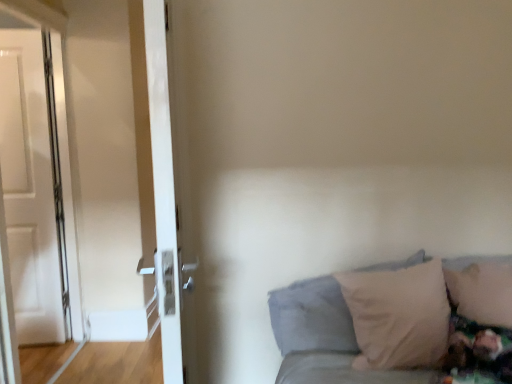
Locate an element on the screen. The image size is (512, 384). soft beige pillow at lower right, which appears as the second pillow when viewed from the right is located at coordinates (312, 317).

At what (x,y) coordinates should I click in order to perform the action: click on white glossy door at left, the 1th door viewed from the back. Please return your answer as a coordinate pair (x, y). The image size is (512, 384). Looking at the image, I should click on (32, 187).

This screenshot has width=512, height=384. I want to click on soft beige pillow at lower right, which appears as the second pillow when viewed from the right, so click(312, 317).

Is white glossy door at left, the first door viewed from the left, next to white glossy door at left, which ranks as the second door in back-to-front order?

No, white glossy door at left, the first door viewed from the left, is not beside white glossy door at left, which ranks as the second door in back-to-front order.

Could you tell me if white glossy door at left, the second door from the right, is facing white glossy door at left, the 2th door when ordered from left to right?

No.

In terms of size, does white glossy door at left, placed as the 2th door when sorted from front to back, appear bigger or smaller than white glossy door at left, the 2th door when ordered from left to right?

Considering their sizes, white glossy door at left, placed as the 2th door when sorted from front to back, takes up less space than white glossy door at left, the 2th door when ordered from left to right.

Is white glossy door at left, the 1th door viewed from the back, not within white glossy door at left, the first door positioned from the front?

That's correct, white glossy door at left, the 1th door viewed from the back, is outside of white glossy door at left, the first door positioned from the front.

From the image's perspective, is beige soft pillow at lower right, which is the first pillow from right to left, positioned above or below soft beige pillow at lower right, which appears as the second pillow when viewed from the right?

Clearly, from the image's perspective, beige soft pillow at lower right, which is the first pillow from right to left, is above soft beige pillow at lower right, which appears as the second pillow when viewed from the right.

Looking at this image, is beige soft pillow at lower right, the second pillow positioned from the left, at the right side of soft beige pillow at lower right, which appears as the second pillow when viewed from the right?

Yes, beige soft pillow at lower right, the second pillow positioned from the left, is to the right of soft beige pillow at lower right, which appears as the second pillow when viewed from the right.

Based on the photo, from a real-world perspective, who is located lower, beige soft pillow at lower right, which is the first pillow from right to left, or soft beige pillow at lower right, positioned as the first pillow in left-to-right order?

soft beige pillow at lower right, positioned as the first pillow in left-to-right order, is physically lower.

How different are the orientations of beige soft pillow at lower right, the second pillow positioned from the left, and white glossy door at left, the 1th door viewed from the back, in degrees?

The angle between the facing direction of beige soft pillow at lower right, the second pillow positioned from the left, and the facing direction of white glossy door at left, the 1th door viewed from the back, is 80.8 degrees.

Is beige soft pillow at lower right, which is the first pillow from right to left, in front of or behind white glossy door at left, the first door viewed from the left, in the image?

beige soft pillow at lower right, which is the first pillow from right to left, is positioned closer to the viewer than white glossy door at left, the first door viewed from the left.

Is white glossy door at left, the 1th door viewed from the back, located within beige soft pillow at lower right, the second pillow positioned from the left?

No, beige soft pillow at lower right, the second pillow positioned from the left, does not contain white glossy door at left, the 1th door viewed from the back.

Between beige soft pillow at lower right, the second pillow positioned from the left, and white glossy door at left, which ranks as the first door in right-to-left order, which one has more height?

Standing taller between the two is white glossy door at left, which ranks as the first door in right-to-left order.

Is beige soft pillow at lower right, which is the first pillow from right to left, completely or partially outside of white glossy door at left, which ranks as the first door in right-to-left order?

beige soft pillow at lower right, which is the first pillow from right to left, lies outside white glossy door at left, which ranks as the first door in right-to-left order,'s area.

Which object is thinner, beige soft pillow at lower right, which is the first pillow from right to left, or white glossy door at left, the 2th door when ordered from left to right?

white glossy door at left, the 2th door when ordered from left to right.

Considering the sizes of objects soft beige pillow at lower right, positioned as the first pillow in left-to-right order, and white glossy door at left, the 2th door when ordered from left to right, in the image provided, who is wider, soft beige pillow at lower right, positioned as the first pillow in left-to-right order, or white glossy door at left, the 2th door when ordered from left to right,?

Wider between the two is soft beige pillow at lower right, positioned as the first pillow in left-to-right order.

Between soft beige pillow at lower right, which appears as the second pillow when viewed from the right, and white glossy door at left, which ranks as the second door in back-to-front order, which one is positioned in front?

white glossy door at left, which ranks as the second door in back-to-front order, is closer to the camera.

How many degrees apart are the facing directions of soft beige pillow at lower right, positioned as the first pillow in left-to-right order, and white glossy door at left, the 2th door when ordered from left to right?

soft beige pillow at lower right, positioned as the first pillow in left-to-right order, and white glossy door at left, the 2th door when ordered from left to right, are facing 166 degrees away from each other.

From the picture: From a real-world perspective, which is physically above, soft beige pillow at lower right, positioned as the first pillow in left-to-right order, or white glossy door at left, which ranks as the second door in back-to-front order?

white glossy door at left, which ranks as the second door in back-to-front order, from a real-world perspective.

Is white glossy door at left, placed as the 2th door when sorted from front to back, in front of soft beige pillow at lower right, which appears as the second pillow when viewed from the right?

That is False.

From a real-world perspective, is white glossy door at left, placed as the 2th door when sorted from front to back, above or below soft beige pillow at lower right, which appears as the second pillow when viewed from the right?

Clearly, from a real-world perspective, white glossy door at left, placed as the 2th door when sorted from front to back, is above soft beige pillow at lower right, which appears as the second pillow when viewed from the right.

Does white glossy door at left, the second door from the right, have a lesser height compared to soft beige pillow at lower right, positioned as the first pillow in left-to-right order?

No.

From the image's perspective, who appears lower, soft beige pillow at lower right, which appears as the second pillow when viewed from the right, or white glossy door at left, the second door from the right?

soft beige pillow at lower right, which appears as the second pillow when viewed from the right.

Considering the relative positions of soft beige pillow at lower right, positioned as the first pillow in left-to-right order, and white glossy door at left, the second door from the right, in the image provided, is soft beige pillow at lower right, positioned as the first pillow in left-to-right order, to the left or to the right of white glossy door at left, the second door from the right,?

soft beige pillow at lower right, positioned as the first pillow in left-to-right order, is positioned on white glossy door at left, the second door from the right,'s right side.

Does point (286, 335) appear closer or farther from the camera than point (8, 166)?

Point (286, 335) is closer to the camera than point (8, 166).

This screenshot has height=384, width=512. In order to click on door located below the white glossy door at left, the first door viewed from the left (from the image's perspective) in this screenshot , I will do `click(163, 190)`.

You are a GUI agent. You are given a task and a screenshot of the screen. Output one action in this format:
    pyautogui.click(x=<x>, y=<y>)
    Task: Click on the pillow on the left of beige soft pillow at lower right, the second pillow positioned from the left
    Image resolution: width=512 pixels, height=384 pixels.
    Given the screenshot: What is the action you would take?
    [312, 317]

Considering their positions, is beige soft pillow at lower right, the second pillow positioned from the left, positioned further to white glossy door at left, the first door viewed from the left, than white glossy door at left, which ranks as the first door in right-to-left order?

beige soft pillow at lower right, the second pillow positioned from the left, is further to white glossy door at left, the first door viewed from the left.

Estimate the real-world distances between objects in this image. Which object is closer to soft beige pillow at lower right, positioned as the first pillow in left-to-right order, white glossy door at left, the 1th door viewed from the back, or beige soft pillow at lower right, which is the first pillow from right to left?

beige soft pillow at lower right, which is the first pillow from right to left, is closer to soft beige pillow at lower right, positioned as the first pillow in left-to-right order.

Considering their positions, is soft beige pillow at lower right, positioned as the first pillow in left-to-right order, positioned closer to white glossy door at left, the 1th door viewed from the back, than white glossy door at left, the first door positioned from the front?

Based on the image, soft beige pillow at lower right, positioned as the first pillow in left-to-right order, appears to be nearer to white glossy door at left, the 1th door viewed from the back.

Looking at the image, which one is located closer to beige soft pillow at lower right, which is the first pillow from right to left, white glossy door at left, the first door positioned from the front, or white glossy door at left, placed as the 2th door when sorted from front to back?

Based on the image, white glossy door at left, the first door positioned from the front, appears to be nearer to beige soft pillow at lower right, which is the first pillow from right to left.

From the image, which object appears to be nearer to soft beige pillow at lower right, positioned as the first pillow in left-to-right order, beige soft pillow at lower right, which is the first pillow from right to left, or white glossy door at left, the 2th door when ordered from left to right?

beige soft pillow at lower right, which is the first pillow from right to left, lies closer to soft beige pillow at lower right, positioned as the first pillow in left-to-right order, than the other object.

Estimate the real-world distances between objects in this image. Which object is closer to white glossy door at left, the 2th door when ordered from left to right, white glossy door at left, the 1th door viewed from the back, or beige soft pillow at lower right, the second pillow positioned from the left?

beige soft pillow at lower right, the second pillow positioned from the left, lies closer to white glossy door at left, the 2th door when ordered from left to right, than the other object.

Based on their spatial positions, is soft beige pillow at lower right, positioned as the first pillow in left-to-right order, or white glossy door at left, the second door from the right, closer to beige soft pillow at lower right, which is the first pillow from right to left?

soft beige pillow at lower right, positioned as the first pillow in left-to-right order.

Estimate the real-world distances between objects in this image. Which object is further from beige soft pillow at lower right, the second pillow positioned from the left, white glossy door at left, the 1th door viewed from the back, or soft beige pillow at lower right, which appears as the second pillow when viewed from the right?

white glossy door at left, the 1th door viewed from the back, lies further to beige soft pillow at lower right, the second pillow positioned from the left, than the other object.

The width and height of the screenshot is (512, 384). Find the location of `pillow between white glossy door at left, the first door viewed from the left, and beige soft pillow at lower right, which is the first pillow from right to left, in the horizontal direction`. pillow between white glossy door at left, the first door viewed from the left, and beige soft pillow at lower right, which is the first pillow from right to left, in the horizontal direction is located at coordinates pyautogui.click(x=312, y=317).

At what (x,y) coordinates should I click in order to perform the action: click on door situated between white glossy door at left, the first door viewed from the left, and soft beige pillow at lower right, positioned as the first pillow in left-to-right order, from left to right. Please return your answer as a coordinate pair (x, y). Looking at the image, I should click on (163, 190).

Identify the location of door between white glossy door at left, placed as the 2th door when sorted from front to back, and beige soft pillow at lower right, which is the first pillow from right to left. (163, 190).

Where is `pillow located between white glossy door at left, the 2th door when ordered from left to right, and beige soft pillow at lower right, the second pillow positioned from the left, in the left-right direction`? Image resolution: width=512 pixels, height=384 pixels. pillow located between white glossy door at left, the 2th door when ordered from left to right, and beige soft pillow at lower right, the second pillow positioned from the left, in the left-right direction is located at coordinates (312, 317).